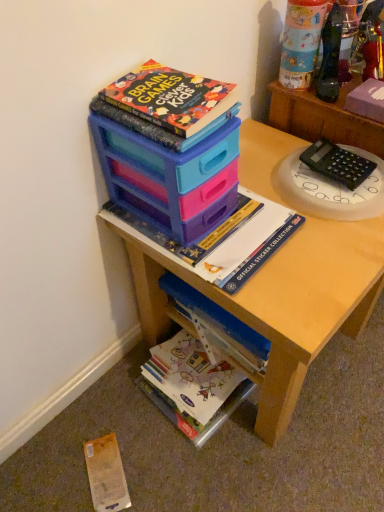
Locate an element on the screen. vacant area that is in front of wooden desk at center is located at coordinates (260, 462).